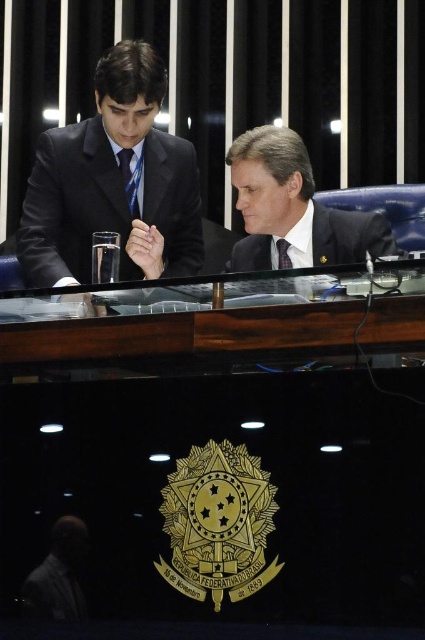
Question: Is matte black suit at left above matte blue tie at center?

Choices:
 (A) yes
 (B) no

Answer: (A)

Question: Which of the following is the farthest from the observer?

Choices:
 (A) black glass table at center
 (B) blue silk tie at left
 (C) matte black suit at left
 (D) dark matte suit at lower left

Answer: (B)

Question: Estimate the real-world distances between objects in this image. Which object is closer to the blue silk tie at left?

Choices:
 (A) dark matte suit at lower left
 (B) black glass table at center

Answer: (B)

Question: Which object is closer to the camera taking this photo?

Choices:
 (A) blue silk tie at left
 (B) black glass table at center

Answer: (B)

Question: Is matte black suit at left above matte black suit at center?

Choices:
 (A) yes
 (B) no

Answer: (A)

Question: Is matte black suit at left thinner than blue silk tie at left?

Choices:
 (A) yes
 (B) no

Answer: (B)